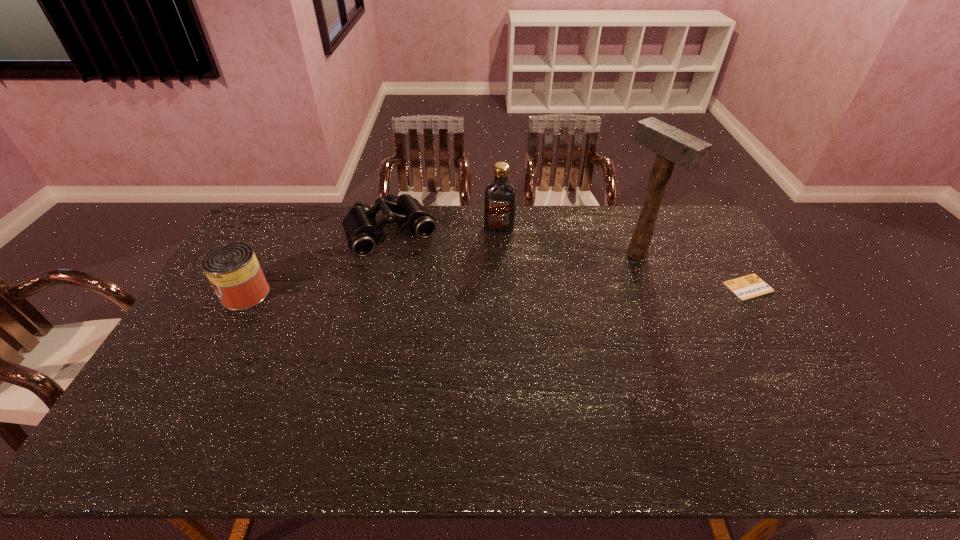
The height and width of the screenshot is (540, 960). Identify the location of free point located on the back of the can. (268, 253).

The height and width of the screenshot is (540, 960). Identify the location of free space located 0.210m on the back of the rightmost object. (715, 235).

You are a GUI agent. You are given a task and a screenshot of the screen. Output one action in this format:
    pyautogui.click(x=<x>, y=<y>)
    Task: Click on the free spot located 0.170m on the striking surface of the second object from right to left
    
    Given the screenshot: What is the action you would take?
    pyautogui.click(x=582, y=283)

Find the location of a particular element. Image resolution: width=960 pixels, height=540 pixels. vacant space positioned on the striking surface of the second object from right to left is located at coordinates (540, 303).

Where is `vacant space positioned on the striking surface of the second object from right to left`? The width and height of the screenshot is (960, 540). vacant space positioned on the striking surface of the second object from right to left is located at coordinates (588, 280).

This screenshot has width=960, height=540. Identify the location of free region located on the front-facing side of the third object from left to right. (494, 245).

Where is `vacant space located on the front-facing side of the third object from left to right`? The width and height of the screenshot is (960, 540). vacant space located on the front-facing side of the third object from left to right is located at coordinates (495, 241).

What are the coordinates of `vacant space located on the front-facing side of the third object from left to right` in the screenshot? It's located at (489, 273).

At what (x,y) coordinates should I click in order to perform the action: click on free space located on the front-facing side of the second object from left to right. Please return your answer as a coordinate pair (x, y). The image size is (960, 540). Looking at the image, I should click on (426, 288).

At what (x,y) coordinates should I click in order to perform the action: click on vacant point located 0.140m on the front-facing side of the second object from left to right. Please return your answer as a coordinate pair (x, y). The width and height of the screenshot is (960, 540). Looking at the image, I should click on (423, 282).